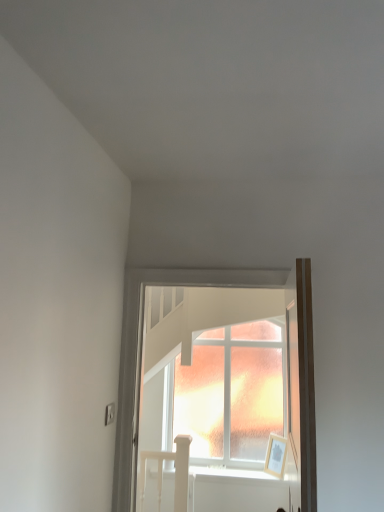
Question: From the image's perspective, relative to white wooden bed at lower left, is frosted glass window at center above or below?

Choices:
 (A) above
 (B) below

Answer: (A)

Question: Is frosted glass window at center spatially inside white wooden bed at lower left, or outside of it?

Choices:
 (A) inside
 (B) outside

Answer: (B)

Question: In terms of width, does frosted glass window at center look wider or thinner when compared to white wooden bed at lower left?

Choices:
 (A) thin
 (B) wide

Answer: (B)

Question: Looking at their shapes, would you say white wooden bed at lower left is wider or thinner than frosted glass window at center?

Choices:
 (A) wide
 (B) thin

Answer: (B)

Question: From the image's perspective, is white wooden bed at lower left above or below frosted glass window at center?

Choices:
 (A) above
 (B) below

Answer: (B)

Question: In terms of height, does white wooden bed at lower left look taller or shorter compared to frosted glass window at center?

Choices:
 (A) short
 (B) tall

Answer: (A)

Question: Do you think white wooden bed at lower left is within frosted glass window at center, or outside of it?

Choices:
 (A) inside
 (B) outside

Answer: (B)